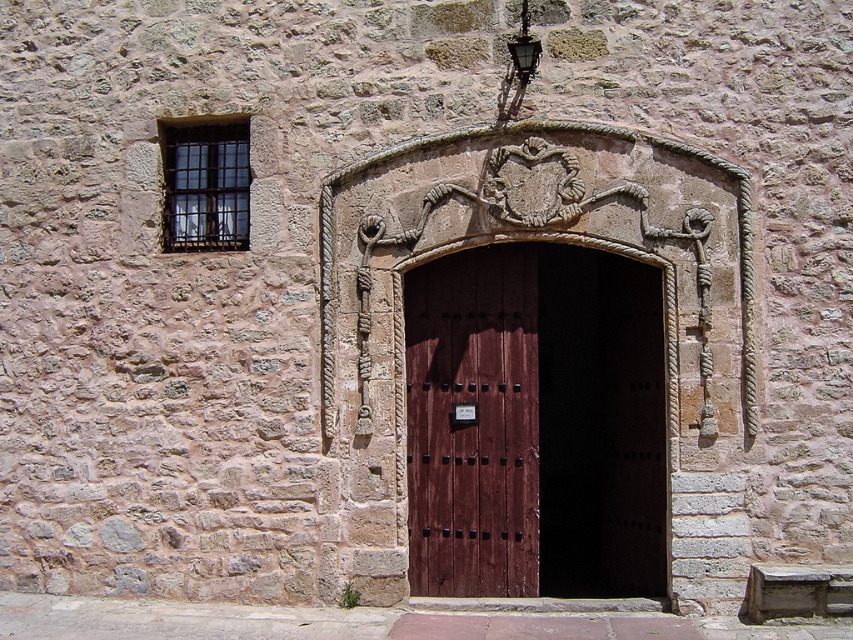
Based on the photo, who is positioned more to the left, dark wood door at center or smooth dark wood door at center?

smooth dark wood door at center

From the picture: Is dark wood door at center to the right of smooth dark wood door at center from the viewer's perspective?

Yes, dark wood door at center is to the right of smooth dark wood door at center.

Locate an element on the screen. dark wood door at center is located at coordinates (535, 422).

Where is `dark wood door at center`? dark wood door at center is located at coordinates (535, 422).